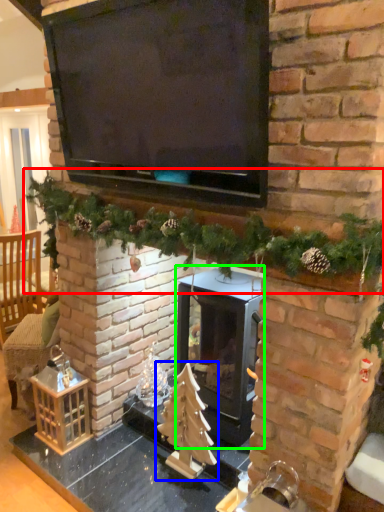
Question: Based on their relative distances, which object is farther from christmas decoration (highlighted by a red box)? Choose from christmas tree (highlighted by a blue box) and wood burning stove (highlighted by a green box).

Choices:
 (A) christmas tree
 (B) wood burning stove

Answer: (A)